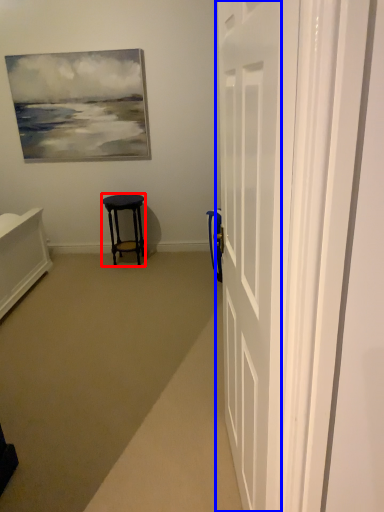
Question: Among these objects, which one is farthest to the camera, stool (highlighted by a red box) or door (highlighted by a blue box)?

Choices:
 (A) stool
 (B) door

Answer: (A)